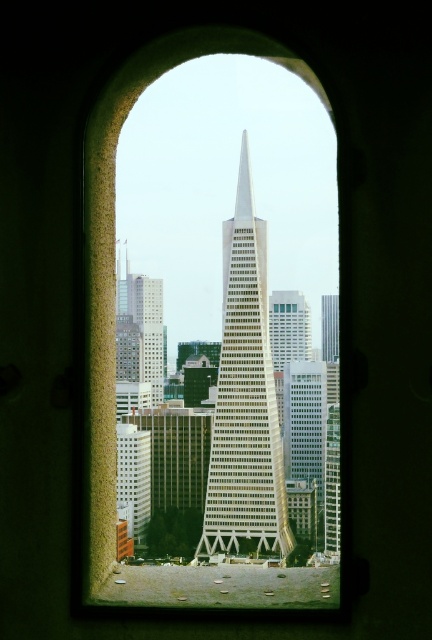
Can you confirm if white glass skyscraper at center is positioned to the left of glassy reflective skyscraper at center?

Indeed, white glass skyscraper at center is positioned on the left side of glassy reflective skyscraper at center.

Does white glass skyscraper at center have a larger size compared to glassy reflective skyscraper at center?

Yes, white glass skyscraper at center is bigger than glassy reflective skyscraper at center.

Is point (250, 401) more distant than point (327, 342)?

No, it is not.

Locate an element on the screen. This screenshot has width=432, height=640. white glass skyscraper at center is located at coordinates (244, 397).